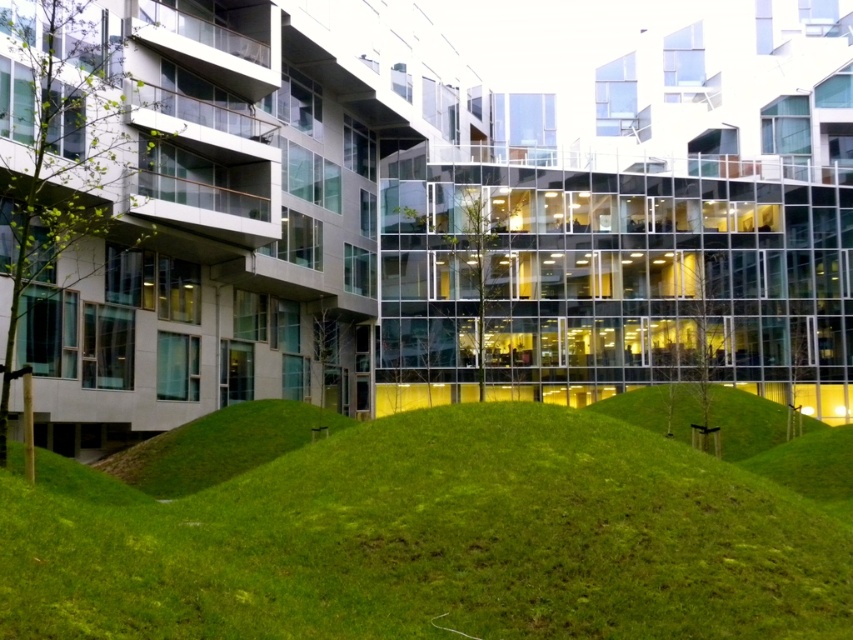
Is green grassy hill at center in front of green grassy mound at center?

Yes, it is.

You are a GUI agent. You are given a task and a screenshot of the screen. Output one action in this format:
    pyautogui.click(x=<x>, y=<y>)
    Task: Click on the green grassy hill at center
    
    Given the screenshot: What is the action you would take?
    pyautogui.click(x=432, y=540)